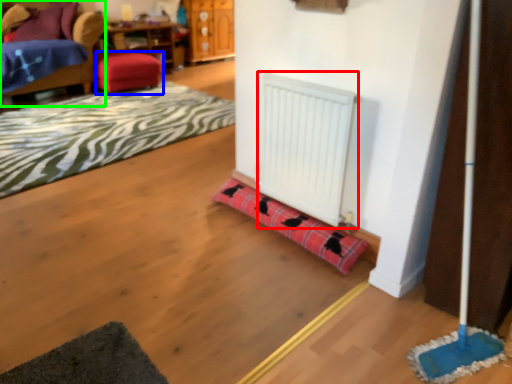
Question: Estimate the real-world distances between objects in this image. Which object is closer to radiator (highlighted by a red box), stool (highlighted by a blue box) or furniture (highlighted by a green box)?

Choices:
 (A) stool
 (B) furniture

Answer: (A)